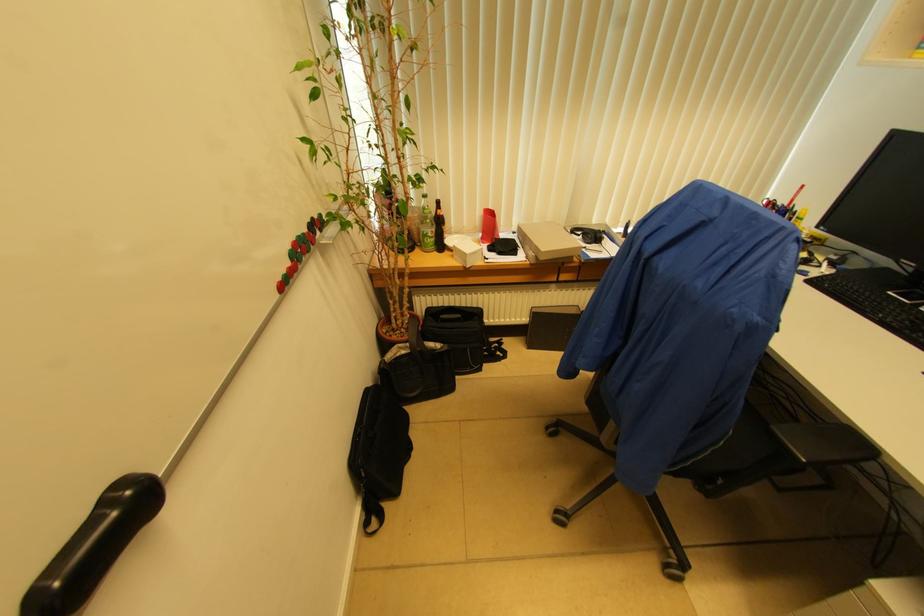
At what (x,y) coordinates should I click in order to perform the action: click on black headphones. Please return your answer as a coordinate pair (x, y). Looking at the image, I should click on (588, 233).